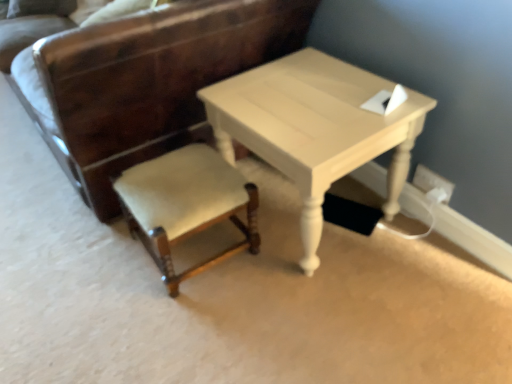
Question: Can you confirm if velvet beige stool at center, which appears as the 1th chair when ordered from the bottom, is taller than white plastic electric outlet at lower right?

Choices:
 (A) no
 (B) yes

Answer: (B)

Question: Is velvet beige stool at center, the 2th chair in the top-to-bottom sequence, far away from white plastic electric outlet at lower right?

Choices:
 (A) yes
 (B) no

Answer: (B)

Question: Are velvet beige stool at center, the 2th chair in the top-to-bottom sequence, and white plastic electric outlet at lower right beside each other?

Choices:
 (A) no
 (B) yes

Answer: (A)

Question: Is velvet beige stool at center, the 2th chair in the top-to-bottom sequence, at the left side of white plastic electric outlet at lower right?

Choices:
 (A) no
 (B) yes

Answer: (B)

Question: Can you confirm if velvet beige stool at center, which appears as the 1th chair when ordered from the bottom, is bigger than white plastic electric outlet at lower right?

Choices:
 (A) no
 (B) yes

Answer: (B)

Question: Is velvet beige stool at center, which appears as the 1th chair when ordered from the bottom, facing towards white plastic electric outlet at lower right?

Choices:
 (A) no
 (B) yes

Answer: (A)

Question: From a real-world perspective, is velvet beige chair at lower left, the 2th chair positioned from the bottom, physically below light beige wood table at center?

Choices:
 (A) yes
 (B) no

Answer: (B)

Question: Is velvet beige chair at lower left, the 1th chair when ordered from top to bottom, wider than light beige wood table at center?

Choices:
 (A) yes
 (B) no

Answer: (A)

Question: Can you confirm if velvet beige chair at lower left, the 2th chair positioned from the bottom, is thinner than light beige wood table at center?

Choices:
 (A) yes
 (B) no

Answer: (B)

Question: Is velvet beige chair at lower left, the 2th chair positioned from the bottom, facing away from light beige wood table at center?

Choices:
 (A) no
 (B) yes

Answer: (A)

Question: Does velvet beige chair at lower left, the 2th chair positioned from the bottom, have a smaller size compared to light beige wood table at center?

Choices:
 (A) yes
 (B) no

Answer: (B)

Question: Can you see velvet beige chair at lower left, the 2th chair positioned from the bottom, touching light beige wood table at center?

Choices:
 (A) no
 (B) yes

Answer: (A)

Question: Is velvet beige stool at center, which appears as the 1th chair when ordered from the bottom, next to light beige wood table at center?

Choices:
 (A) yes
 (B) no

Answer: (B)